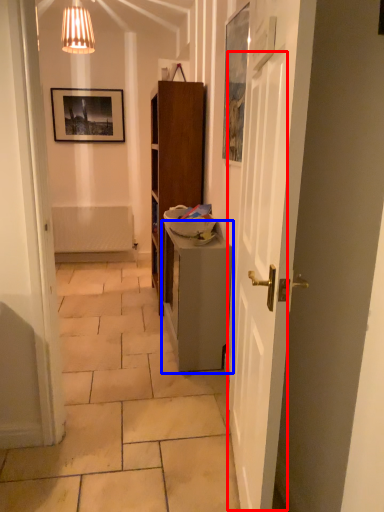
Question: Which object is closer to the camera taking this photo, door (highlighted by a red box) or table (highlighted by a blue box)?

Choices:
 (A) door
 (B) table

Answer: (A)